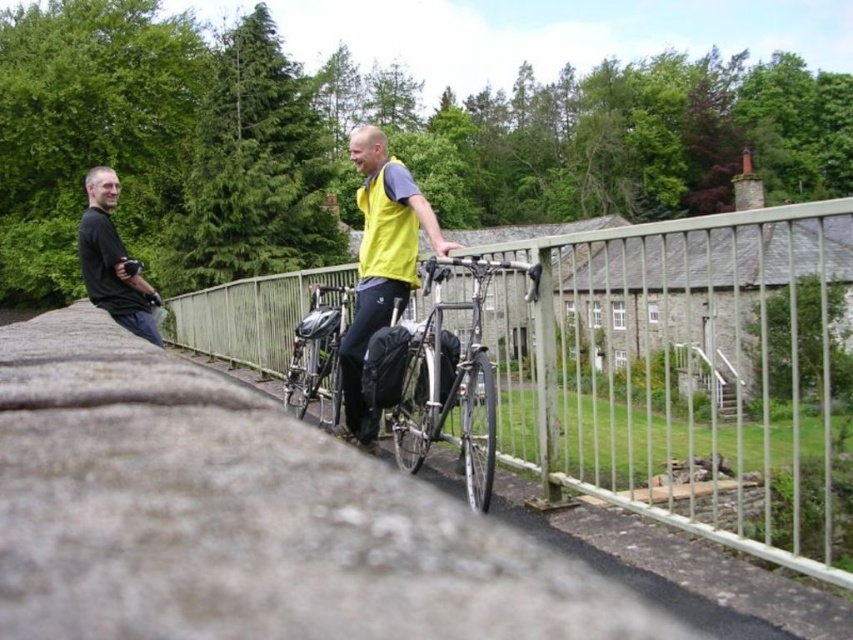
You are standing on the bridge and want to take a photo of the shiny black bicycle at center without including the metallic silver fence at center in the frame. Which direction should you move relative to the bicycle?

The metallic silver fence at center is to the right of the shiny black bicycle at center. To avoid including the fence in the photo, you should move to the right side of the bicycle.

You are standing at point (113, 300) and want to walk to point (659, 298). Which direction should you face to move towards your destination?

You should face upwards because point (659, 298) is behind point (113, 300), meaning it is in the upward direction from your current position.